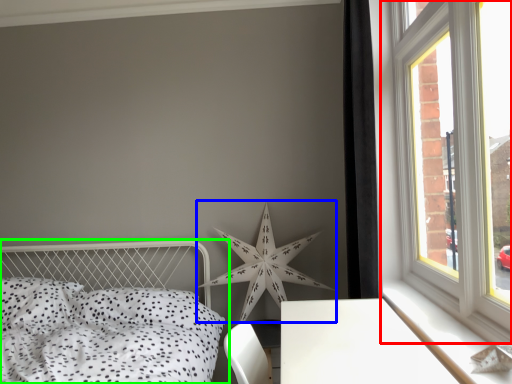
Question: Based on their relative distances, which object is farther from window (highlighted by a red box)? Choose from star (highlighted by a blue box) and bed (highlighted by a green box).

Choices:
 (A) star
 (B) bed

Answer: (B)